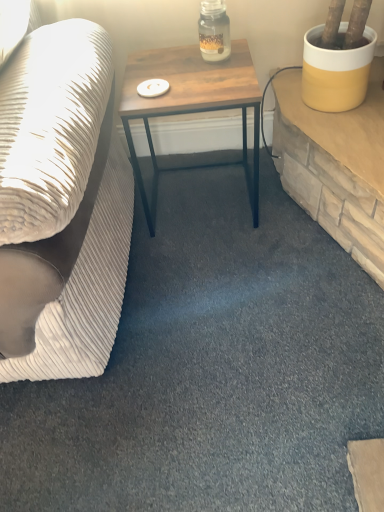
This screenshot has height=512, width=384. I want to click on blank space to the left of translucent glass jar at center, so click(x=168, y=61).